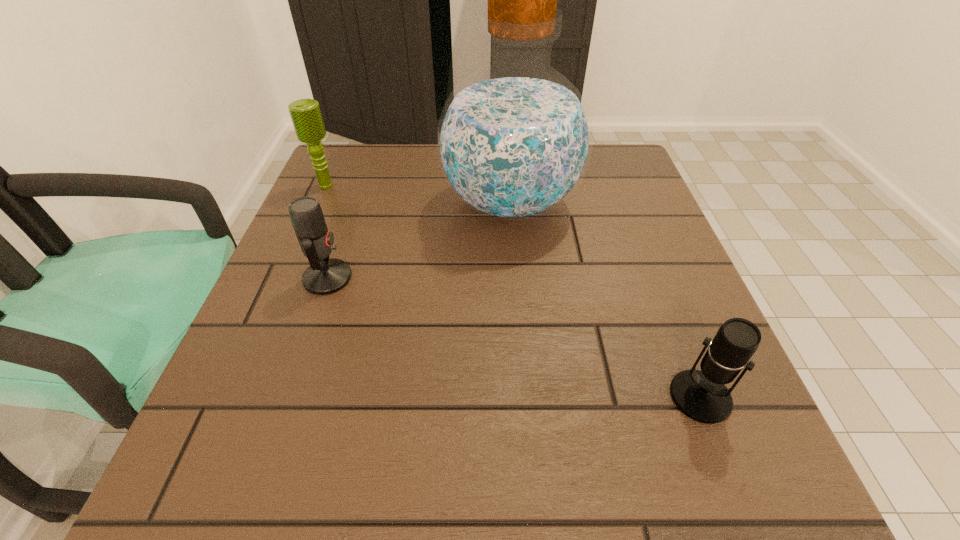
Point out which object is positioned as the nearest to the third object from right to left. Please provide its 2D coordinates. Your answer should be formatted as a tuple, i.e. [(x, y)], where the tuple contains the x and y coordinates of a point satisfying the conditions above.

[(514, 140)]

Identify which microphone is the closest to the rightmost object. Please provide its 2D coordinates. Your answer should be formatted as a tuple, i.e. [(x, y)], where the tuple contains the x and y coordinates of a point satisfying the conditions above.

[(324, 276)]

This screenshot has height=540, width=960. I want to click on microphone identified as the closest to the third object from right to left, so click(306, 116).

Image resolution: width=960 pixels, height=540 pixels. Find the location of `vacant area that satisfies the following two spatial constraints: 1. on the side of the second farthest microphone with the red ring; 2. on the back side of the nearest object`. vacant area that satisfies the following two spatial constraints: 1. on the side of the second farthest microphone with the red ring; 2. on the back side of the nearest object is located at coordinates (287, 397).

What are the coordinates of `vacant region that satisfies the following two spatial constraints: 1. on the side of the third object from right to left with the red ring; 2. on the right side of the nearest microphone` in the screenshot? It's located at (287, 397).

The width and height of the screenshot is (960, 540). In order to click on free space that satisfies the following two spatial constraints: 1. on the side of the nearest object with the red ring; 2. on the left side of the third farthest object in this screenshot , I will do `click(287, 397)`.